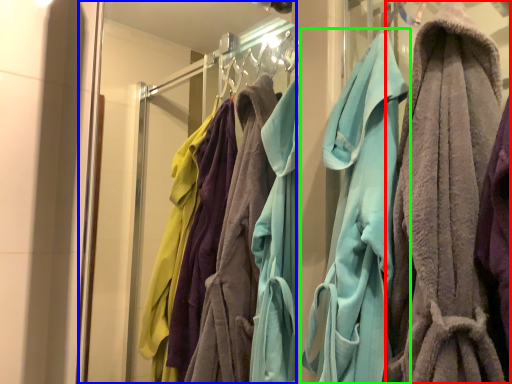
Question: Considering the real-world distances, which object is farthest from towel (highlighted by a red box)? glass door (highlighted by a blue box) or towel (highlighted by a green box)?

Choices:
 (A) glass door
 (B) towel

Answer: (A)